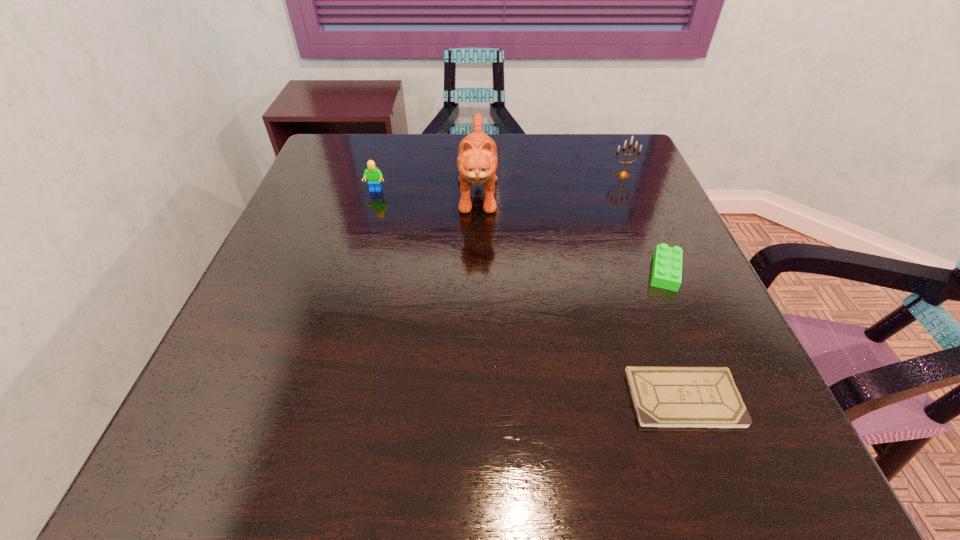
Locate an element on the screen. This screenshot has height=540, width=960. free spot between the checkbook and the cat is located at coordinates (581, 293).

Find the location of a particular element. The image size is (960, 540). vacant space that is in between the taller Lego and the second nearest object is located at coordinates (520, 231).

At what (x,y) coordinates should I click in order to perform the action: click on empty space between the cat and the checkbook. Please return your answer as a coordinate pair (x, y). Looking at the image, I should click on (581, 293).

Where is `free point between the farther Lego and the tallest object`? The width and height of the screenshot is (960, 540). free point between the farther Lego and the tallest object is located at coordinates (427, 189).

Locate an element on the screen. vacant area that lies between the cat and the right Lego is located at coordinates (571, 230).

Image resolution: width=960 pixels, height=540 pixels. Find the location of `vacant area between the shortest object and the cat`. vacant area between the shortest object and the cat is located at coordinates (581, 293).

Locate an element on the screen. object that ranks as the closest to the taller Lego is located at coordinates (477, 161).

Where is `object that is the closest to the candelabrum`? The image size is (960, 540). object that is the closest to the candelabrum is located at coordinates (667, 262).

The height and width of the screenshot is (540, 960). Identify the location of free space that satisfies the following two spatial constraints: 1. on the face of the tallest object; 2. on the right side of the right Lego. (477, 272).

Where is `free space that satisfies the following two spatial constraints: 1. on the face of the farther Lego; 2. on the left side of the fourth farthest object`? The width and height of the screenshot is (960, 540). free space that satisfies the following two spatial constraints: 1. on the face of the farther Lego; 2. on the left side of the fourth farthest object is located at coordinates (352, 272).